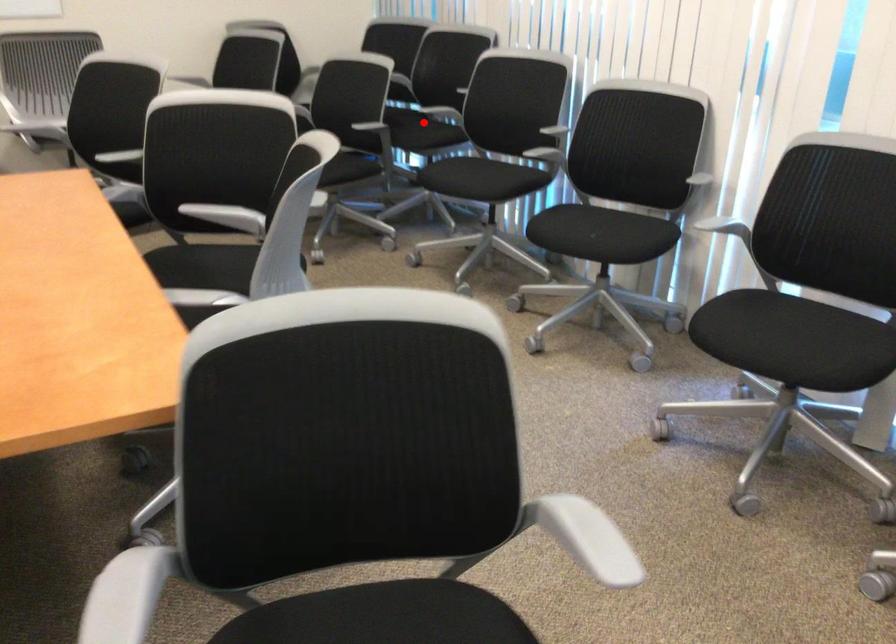
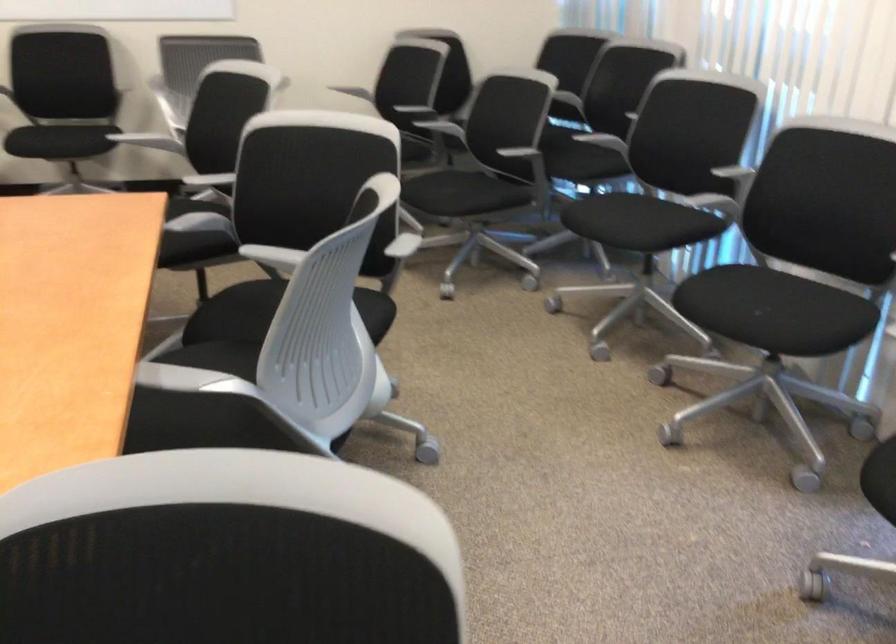
In the second image, find the point that corresponds to the highlighted location in the first image.

(588, 147)